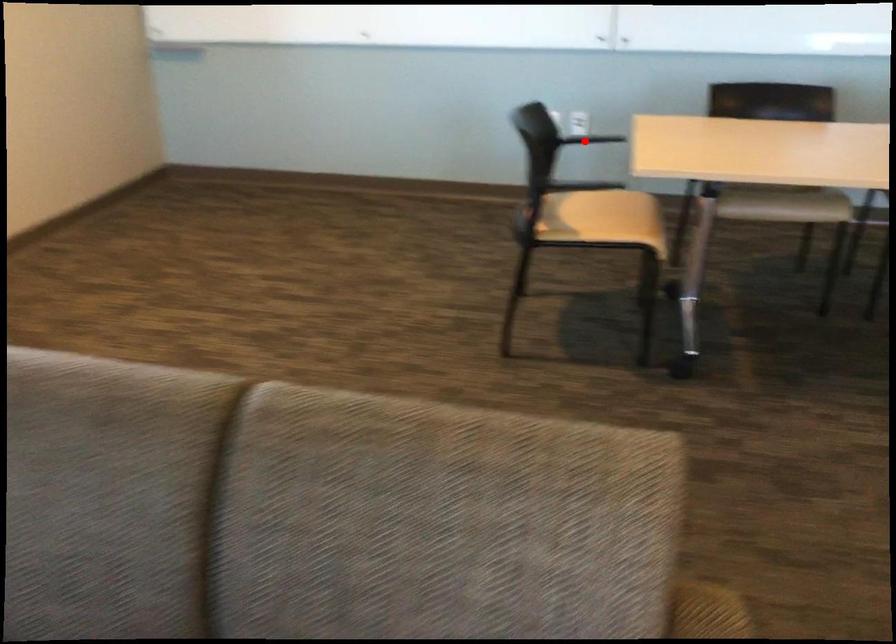
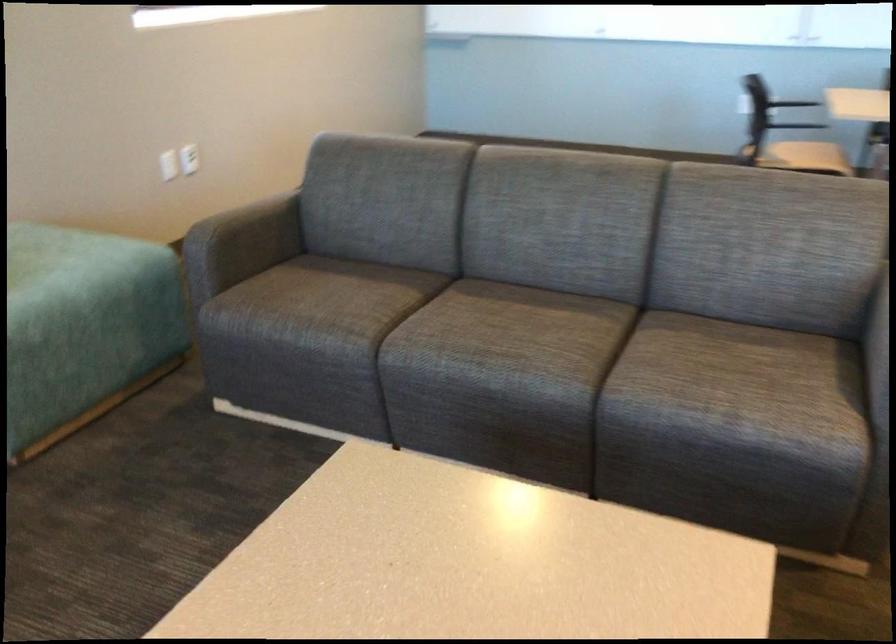
Question: I am providing you with two images of the same scene from different viewpoints. Image1 has a red point marked. In image2, the corresponding 3D location appears at what relative position? Reply with the corresponding letter.

Choices:
 (A) Closer
 (B) Farther

Answer: (B)